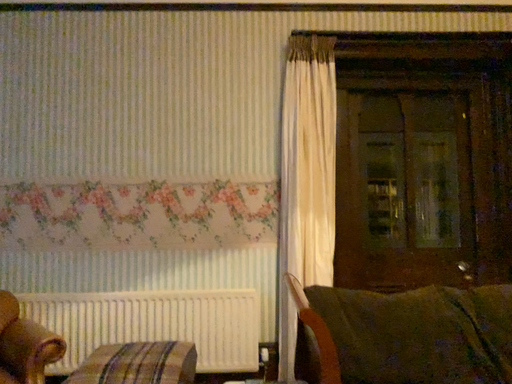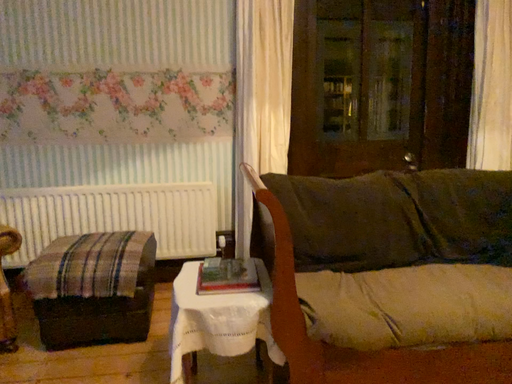
Question: Which way did the camera rotate in the video?

Choices:
 (A) rotated upward
 (B) rotated downward

Answer: (B)